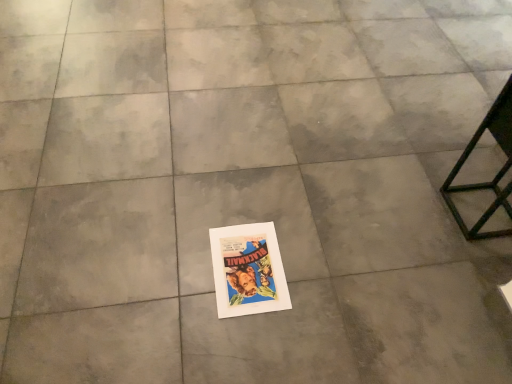
The image size is (512, 384). I want to click on free location in front of metallic black table at right, so click(x=471, y=267).